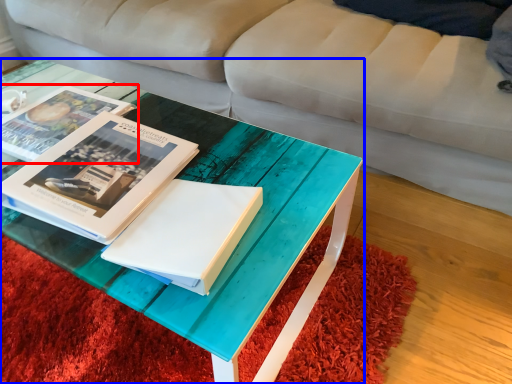
Question: Which of the following is the farthest to the observer, book (highlighted by a red box) or coffee table (highlighted by a blue box)?

Choices:
 (A) book
 (B) coffee table

Answer: (A)